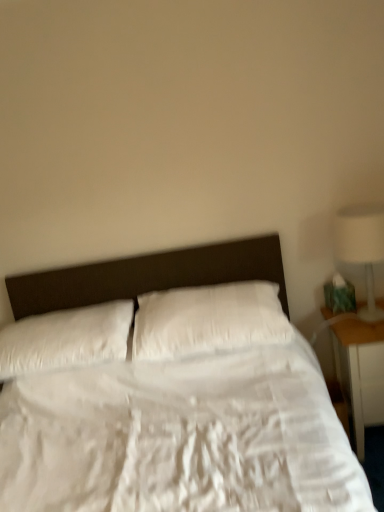
Question: Which direction should I rotate to look at white soft pillow at center, marked as the first pillow in a right-to-left arrangement?

Choices:
 (A) left
 (B) right

Answer: (B)

Question: Is white soft pillow at left, which appears as the 1th pillow when viewed from the left, aimed at wooden nightstand at right?

Choices:
 (A) yes
 (B) no

Answer: (B)

Question: From the image's perspective, is white soft pillow at left, placed as the 2th pillow when sorted from right to left, located above wooden nightstand at right?

Choices:
 (A) no
 (B) yes

Answer: (B)

Question: Considering the relative sizes of white soft pillow at left, placed as the 2th pillow when sorted from right to left, and wooden nightstand at right in the image provided, is white soft pillow at left, placed as the 2th pillow when sorted from right to left, wider than wooden nightstand at right?

Choices:
 (A) no
 (B) yes

Answer: (B)

Question: Is white soft pillow at left, which appears as the 1th pillow when viewed from the left, positioned behind wooden nightstand at right?

Choices:
 (A) no
 (B) yes

Answer: (A)

Question: Considering the relative positions of white soft pillow at left, placed as the 2th pillow when sorted from right to left, and wooden nightstand at right in the image provided, is white soft pillow at left, placed as the 2th pillow when sorted from right to left, to the right of wooden nightstand at right from the viewer's perspective?

Choices:
 (A) yes
 (B) no

Answer: (B)

Question: Does white soft pillow at left, placed as the 2th pillow when sorted from right to left, have a lesser height compared to wooden nightstand at right?

Choices:
 (A) no
 (B) yes

Answer: (B)

Question: Does wooden nightstand at right have a greater height compared to white glossy lamp at right?

Choices:
 (A) no
 (B) yes

Answer: (B)

Question: Is wooden nightstand at right positioned with its back to white glossy lamp at right?

Choices:
 (A) no
 (B) yes

Answer: (A)

Question: Is the depth of wooden nightstand at right greater than that of white glossy lamp at right?

Choices:
 (A) yes
 (B) no

Answer: (A)

Question: Considering the relative positions of wooden nightstand at right and white glossy lamp at right in the image provided, is wooden nightstand at right to the left of white glossy lamp at right from the viewer's perspective?

Choices:
 (A) no
 (B) yes

Answer: (A)

Question: From a real-world perspective, does wooden nightstand at right stand above white glossy lamp at right?

Choices:
 (A) no
 (B) yes

Answer: (A)

Question: From the image's perspective, is wooden nightstand at right above white glossy lamp at right?

Choices:
 (A) no
 (B) yes

Answer: (A)

Question: From a real-world perspective, is white soft pillow at center, arranged as the second pillow when viewed from the left, physically below white glossy lamp at right?

Choices:
 (A) yes
 (B) no

Answer: (A)